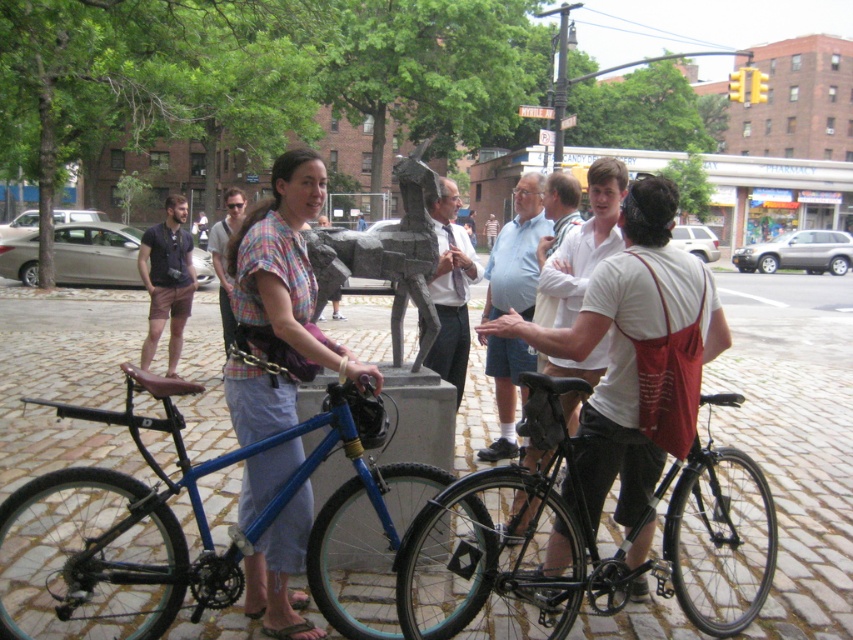
Question: Which point is closer to the camera?

Choices:
 (A) (558, 572)
 (B) (410, 160)

Answer: (A)

Question: Which is farther from the light blue shirt at center?

Choices:
 (A) blue matte bicycle at center
 (B) white cotton shirt at center
 (C) plaid shirt at center
 (D) cobblestone pavement at center

Answer: (D)

Question: Is light blue cotton shirt at center above dark brown leather shorts at left?

Choices:
 (A) yes
 (B) no

Answer: (A)

Question: Can you confirm if cobblestone pavement at center is wider than plaid fabric shirt at center?

Choices:
 (A) yes
 (B) no

Answer: (A)

Question: Which point is farther to the camera?

Choices:
 (A) (471, 256)
 (B) (231, 211)

Answer: (B)

Question: Is blue matte bicycle at center bigger than light blue shirt at center?

Choices:
 (A) yes
 (B) no

Answer: (A)